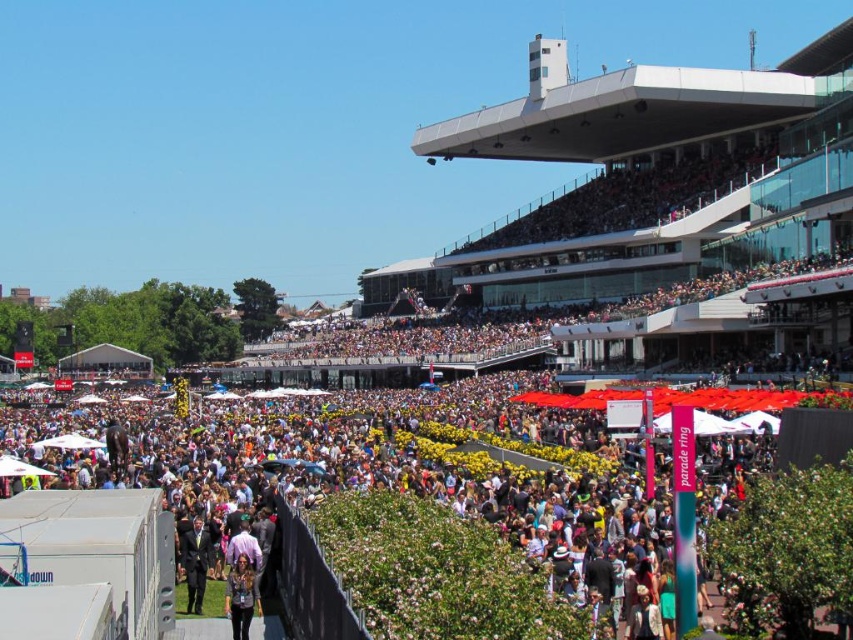
You are standing at the center of the crowd at the event. You notice a black suit at center located at point [195,563]. If you want to move towards the black suit at center, in which direction should you walk?

You should walk towards the point [195,563] where the black suit at center is located.

From the picture: You are standing in the crowd at the event and want to move towards the front. There are two people in your path, one at point (206,572) and another at point (239,579). Which person is closer to you, making them the first obstacle you need to navigate around?

Point (206,572) is closer to you since it is further to the camera than point (239,579), meaning it is physically nearer in your line of sight.